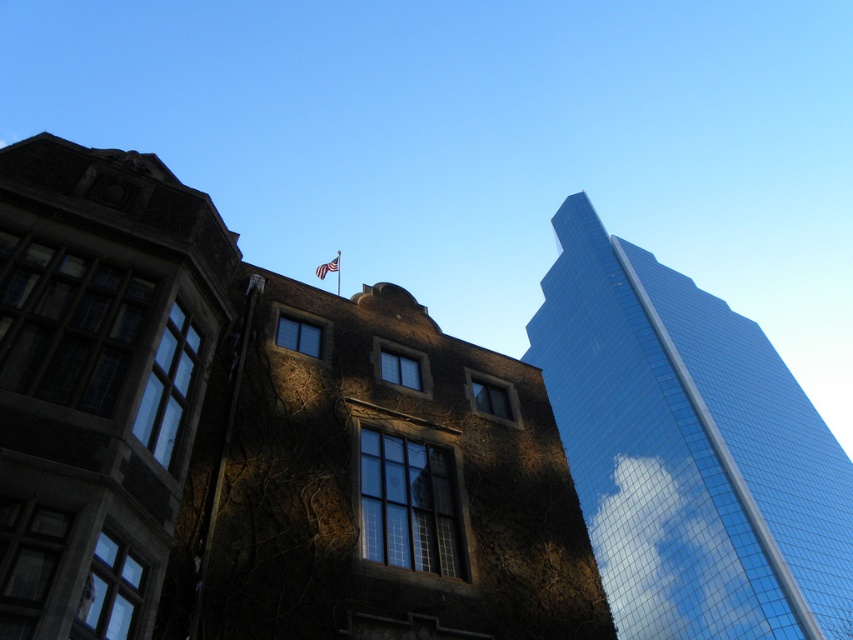
Between shiny glass skyscraper at right and american flag at upper center, which one is positioned lower?

shiny glass skyscraper at right is lower down.

In the scene shown: Who is shorter, shiny glass skyscraper at right or american flag at upper center?

Standing shorter between the two is american flag at upper center.

Which is in front, point (560, 346) or point (323, 262)?

Point (323, 262) is more forward.

Identify the location of shiny glass skyscraper at right. (688, 451).